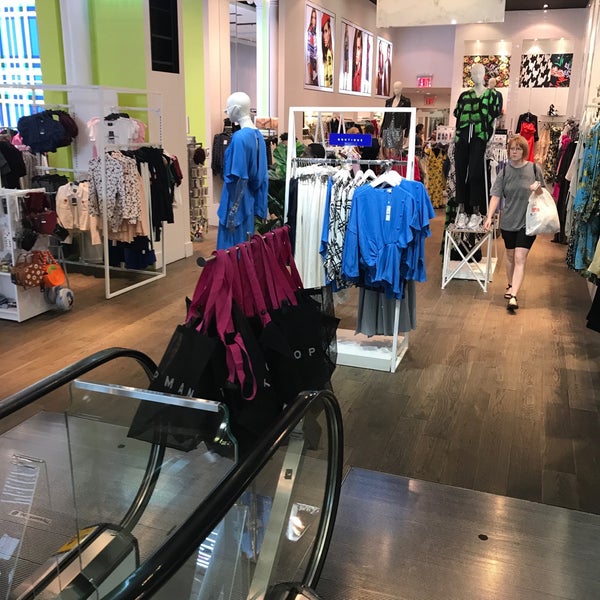
The width and height of the screenshot is (600, 600). What are the coordinates of `green wall` in the screenshot? It's located at (132, 44).